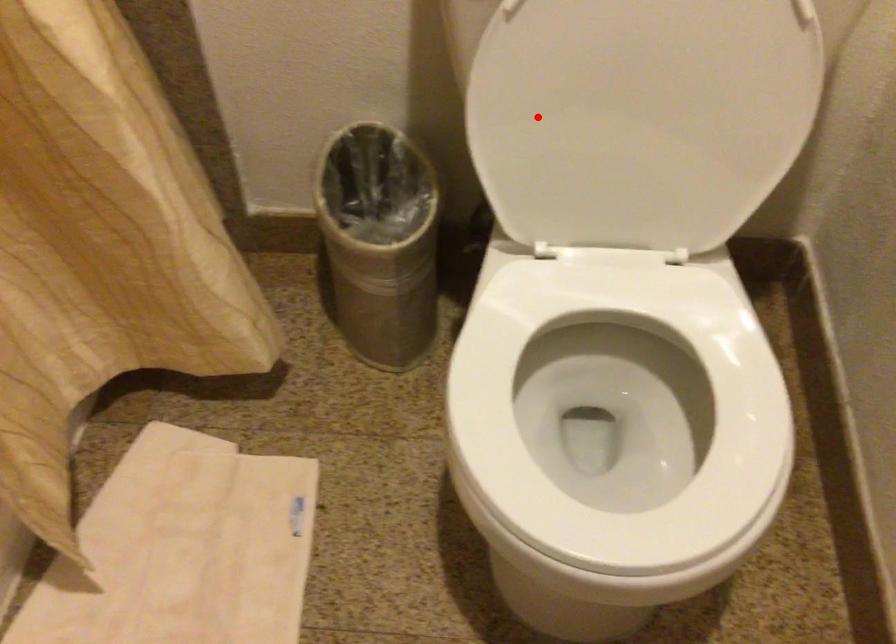
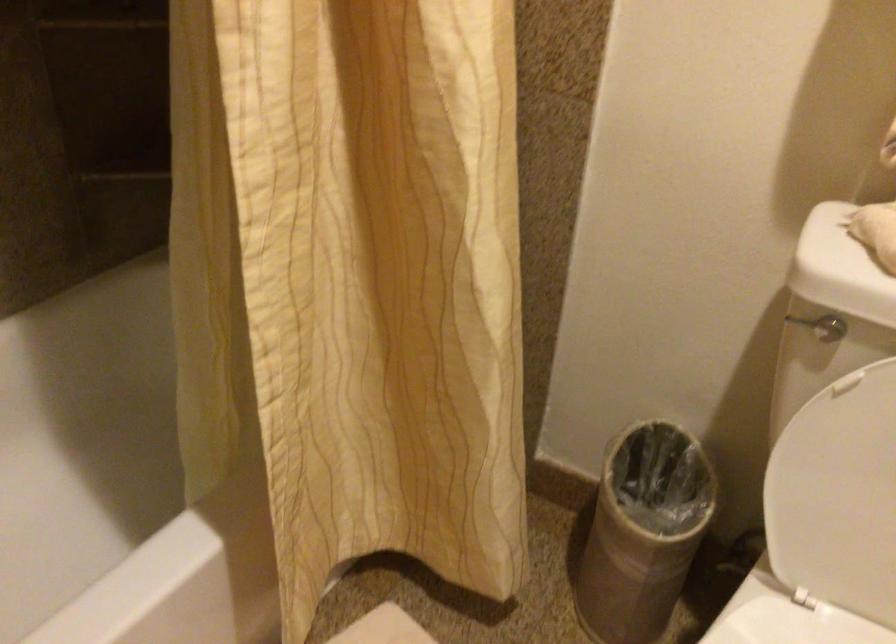
Question: I am providing you with two images of the same scene from different viewpoints. A red point is shown in image1. For the corresponding object point in image2, is it positioned nearer or farther from the camera?

Choices:
 (A) Nearer
 (B) Farther

Answer: (B)